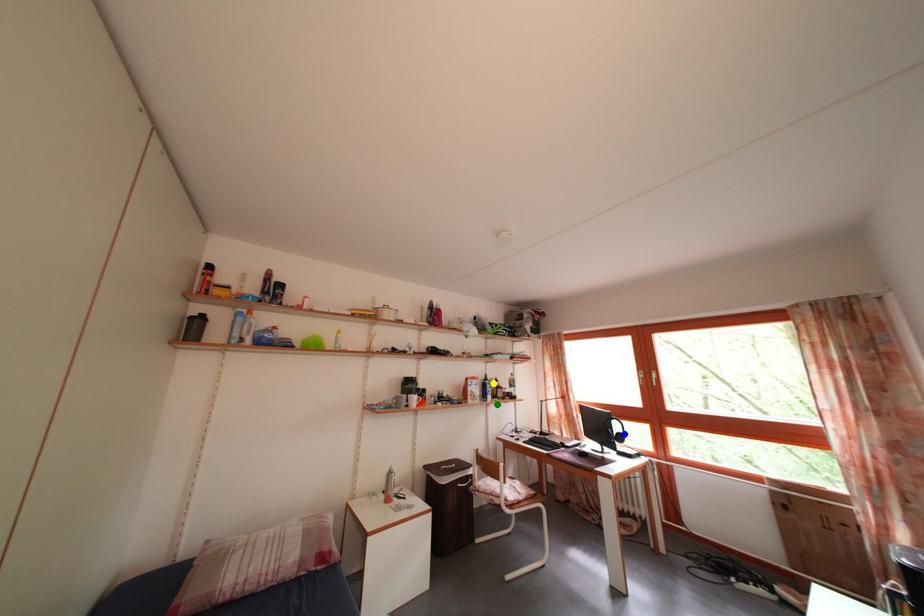
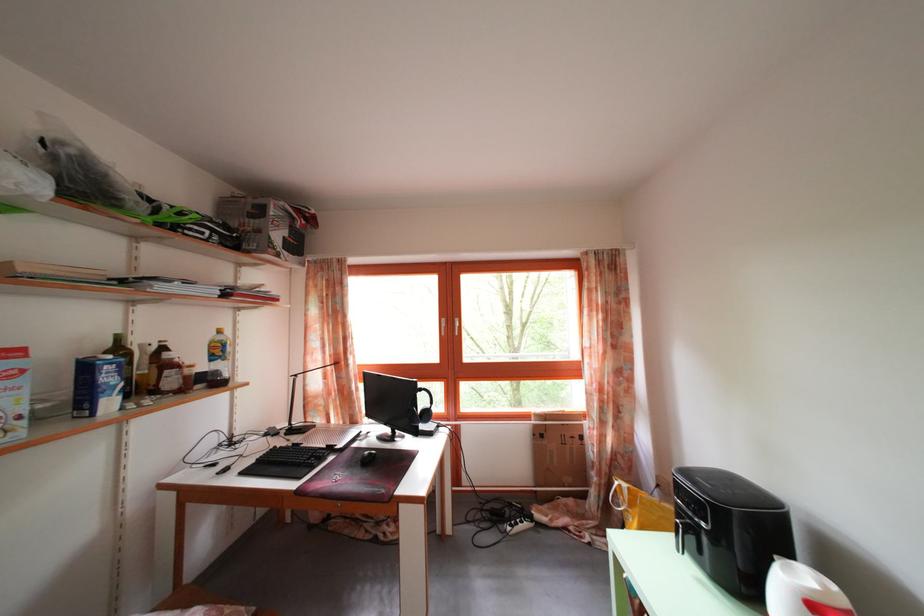
I am providing you with two images of the same scene from different viewpoints. Three points are marked in image1. Which point corresponds to a part or object that is occluded in image2?In image1, three points are marked. Which of them correspond to a part or object that is occluded in image2?Among the three points shown in image1, which one corresponds to a part or object that is no longer visible due to occlusion in image2?

Invisible in image2: blue point.